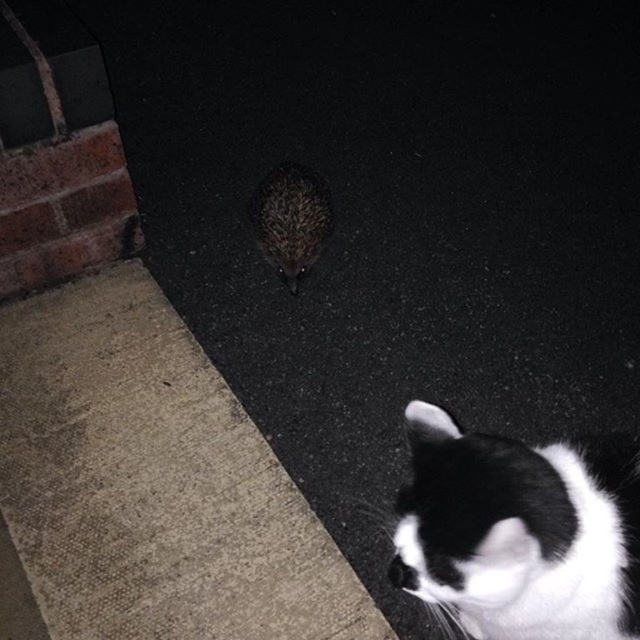
Question: Which object appears closest to the camera in this image?

Choices:
 (A) spiky brown hedgehog at center
 (B) gray concrete pavement at center

Answer: (B)

Question: Among these points, which one is farthest from the camera?

Choices:
 (A) (547, 612)
 (B) (269, 220)

Answer: (B)

Question: Does black and white fur cat at lower right appear over spiky brown hedgehog at center?

Choices:
 (A) yes
 (B) no

Answer: (B)

Question: Does gray concrete pavement at center appear under black and white fur cat at lower right?

Choices:
 (A) no
 (B) yes

Answer: (A)

Question: Which of these objects is positioned farthest from the black and white fur cat at lower right?

Choices:
 (A) gray concrete pavement at center
 (B) spiky brown hedgehog at center

Answer: (B)

Question: Is gray concrete pavement at center to the left of black and white fur cat at lower right from the viewer's perspective?

Choices:
 (A) yes
 (B) no

Answer: (A)